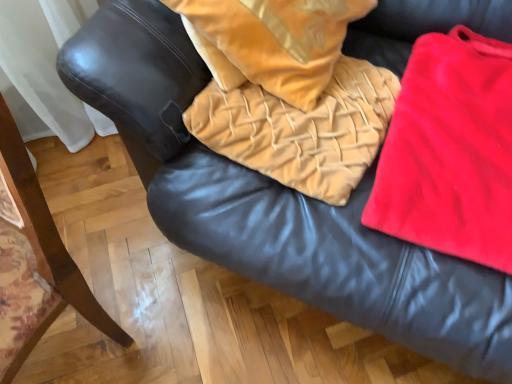
Find the location of a particular element. vacant space underneath matte black armrest at left (from a real-world perspective) is located at coordinates (80, 346).